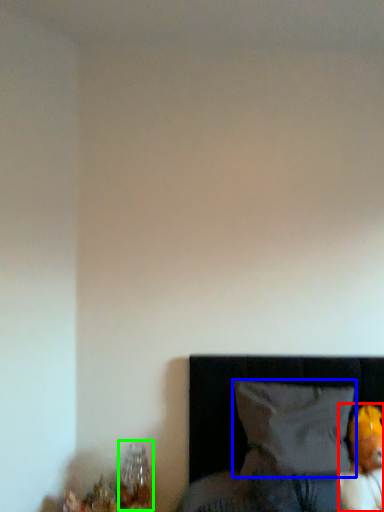
Question: Which object is positioned closest to toy (highlighted by a red box)? Select from pillow (highlighted by a blue box) and table lamp (highlighted by a green box).

Choices:
 (A) pillow
 (B) table lamp

Answer: (A)